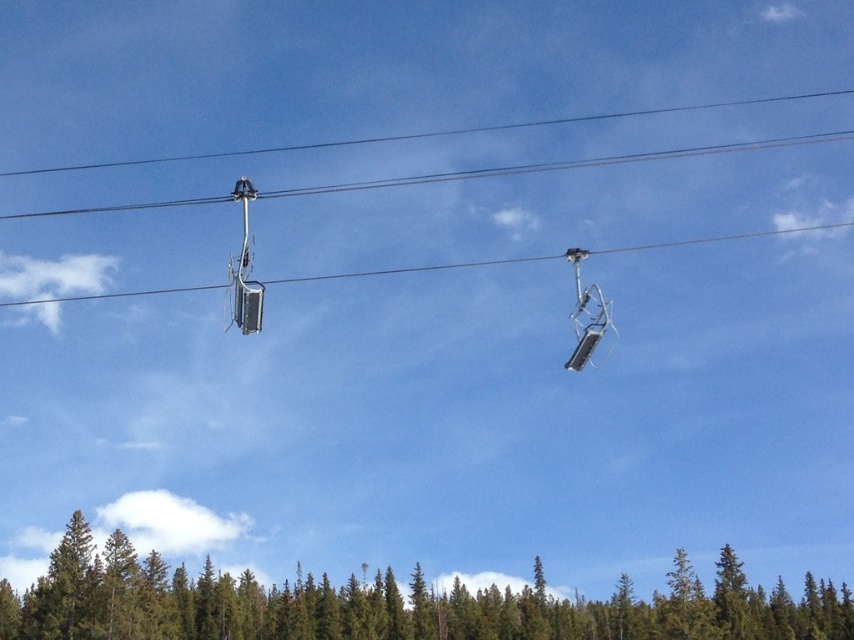
Question: Does metallic gray ski lift at upper center appear on the right side of metallic silver ski lift at upper center?

Choices:
 (A) yes
 (B) no

Answer: (B)

Question: Which object is the farthest from the green textured pine forest at lower center?

Choices:
 (A) metallic silver ski lift at upper center
 (B) metallic gray ski lift at upper center

Answer: (B)

Question: Is green textured pine forest at lower center smaller than metallic silver ski lift at upper center?

Choices:
 (A) no
 (B) yes

Answer: (A)

Question: Which object is positioned farthest from the green textured pine forest at lower center?

Choices:
 (A) metallic gray ski lift at upper center
 (B) metallic silver ski lift at upper center

Answer: (A)

Question: In this image, where is green textured pine forest at lower center located relative to metallic gray ski lift at upper center?

Choices:
 (A) below
 (B) above

Answer: (A)

Question: Which point is closer to the camera taking this photo?

Choices:
 (A) (606, 317)
 (B) (414, 582)

Answer: (A)